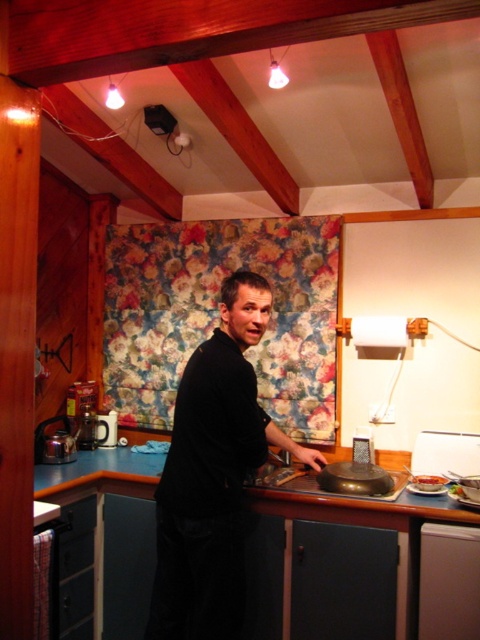
In the scene shown: Who is taller, slightly browned bread at lower right or white glossy plate at lower right?

Standing taller between the two is white glossy plate at lower right.

Is point (428, 490) more distant than point (408, 490)?

No, it is not.

Identify the location of slightly browned bread at lower right. (428, 483).

Which is below, black matte shirt at center or slightly browned bread at lower right?

slightly browned bread at lower right is below.

Can you confirm if black matte shirt at center is positioned to the left of slightly browned bread at lower right?

Correct, you'll find black matte shirt at center to the left of slightly browned bread at lower right.

Is point (192, 506) farther from camera compared to point (437, 483)?

That is False.

The width and height of the screenshot is (480, 640). I want to click on black matte shirt at center, so click(214, 474).

Can you confirm if black matte shirt at center is taller than white glossy plate at lower right?

Correct, black matte shirt at center is much taller as white glossy plate at lower right.

Is point (263, 445) closer to viewer compared to point (436, 493)?

Yes, point (263, 445) is in front of point (436, 493).

Which is in front, point (189, 509) or point (443, 493)?

Point (189, 509) is in front.

You are a GUI agent. You are given a task and a screenshot of the screen. Output one action in this format:
    pyautogui.click(x=<x>, y=<y>)
    Task: Click on the black matte shirt at center
    This screenshot has width=480, height=640.
    Given the screenshot: What is the action you would take?
    pyautogui.click(x=214, y=474)